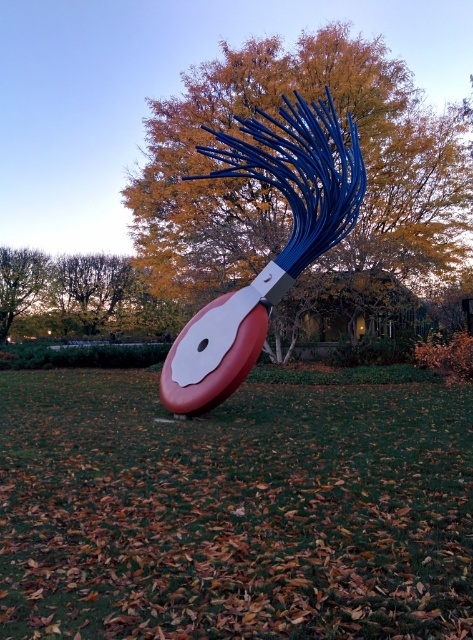
Question: Which object is closer to the camera taking this photo?

Choices:
 (A) metallic blue brush at center
 (B) brown leafy tree at upper left
 (C) green grass at center
 (D) brown/dry leaves at upper left

Answer: (C)

Question: Which object is closer to the camera taking this photo?

Choices:
 (A) metallic blue brush at center
 (B) metallic blue sculpture at center
 (C) brown/dry leaves at upper left

Answer: (A)

Question: Does green grass at center come in front of brown/dry leaves at upper left?

Choices:
 (A) no
 (B) yes

Answer: (B)

Question: Estimate the real-world distances between objects in this image. Which object is closer to the brown/dry leaves at upper left?

Choices:
 (A) metallic blue sculpture at center
 (B) brown leafy tree at upper left

Answer: (B)

Question: Considering the relative positions of metallic blue sculpture at center and brown/dry leaves at upper left in the image provided, where is metallic blue sculpture at center located with respect to brown/dry leaves at upper left?

Choices:
 (A) below
 (B) above

Answer: (B)

Question: Does metallic blue sculpture at center have a larger size compared to brown/dry leaves at upper left?

Choices:
 (A) yes
 (B) no

Answer: (A)